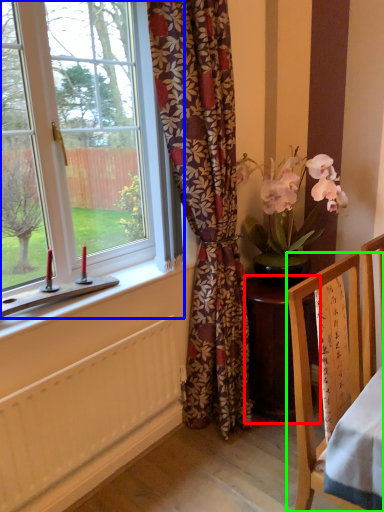
Question: Considering the real-world distances, which object is farthest from desk (highlighted by a red box)? window (highlighted by a blue box) or chair (highlighted by a green box)?

Choices:
 (A) window
 (B) chair

Answer: (A)